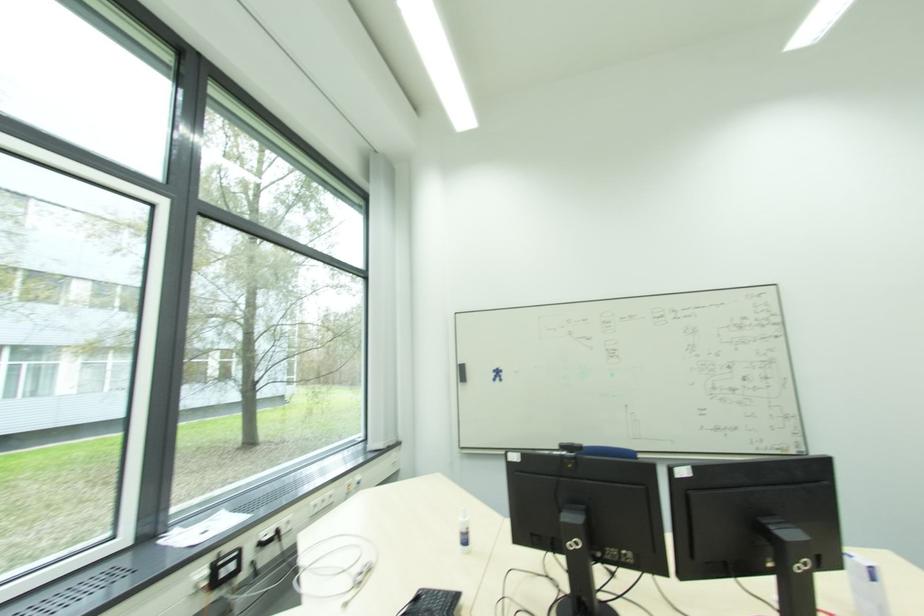
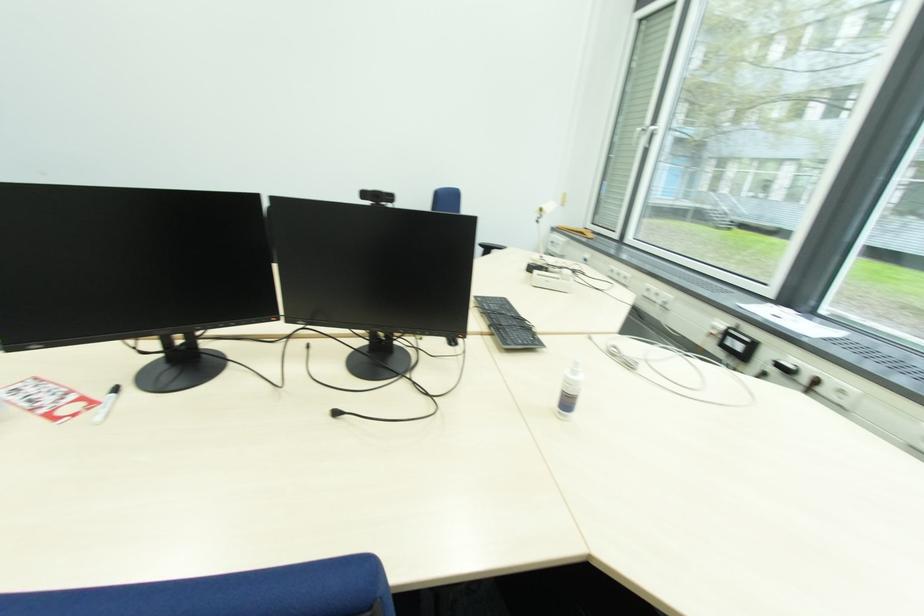
Locate, in the second image, the point that corresponds to point 225,565 in the first image.

(734, 333)